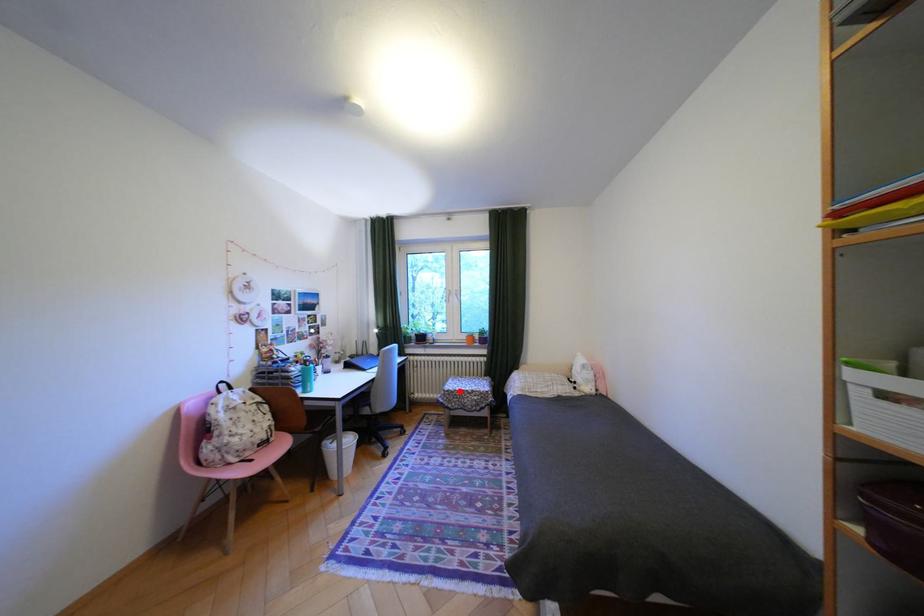
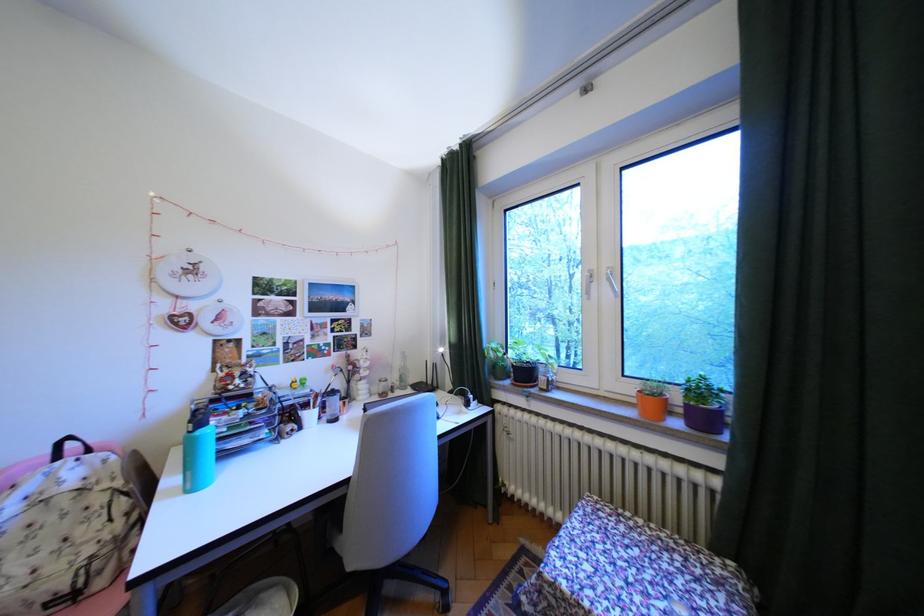
Find the pixel in the second image that matches the highlighted location in the first image.

(564, 585)